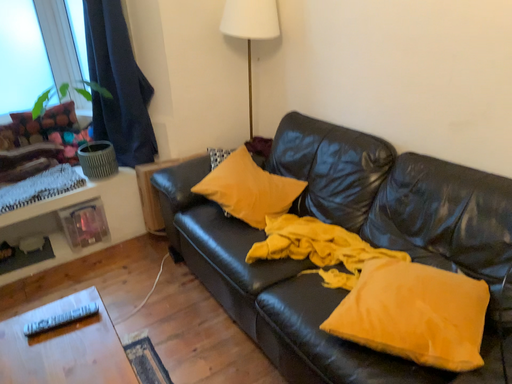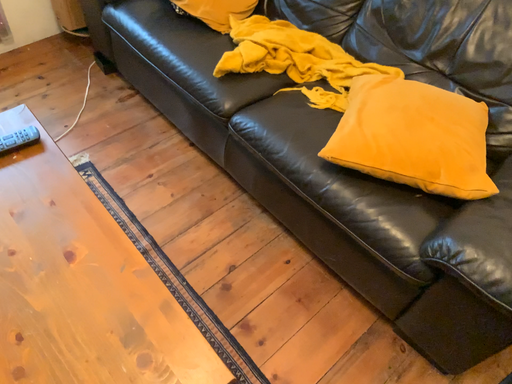
Question: How did the camera likely rotate when shooting the video?

Choices:
 (A) rotated left
 (B) rotated right

Answer: (B)